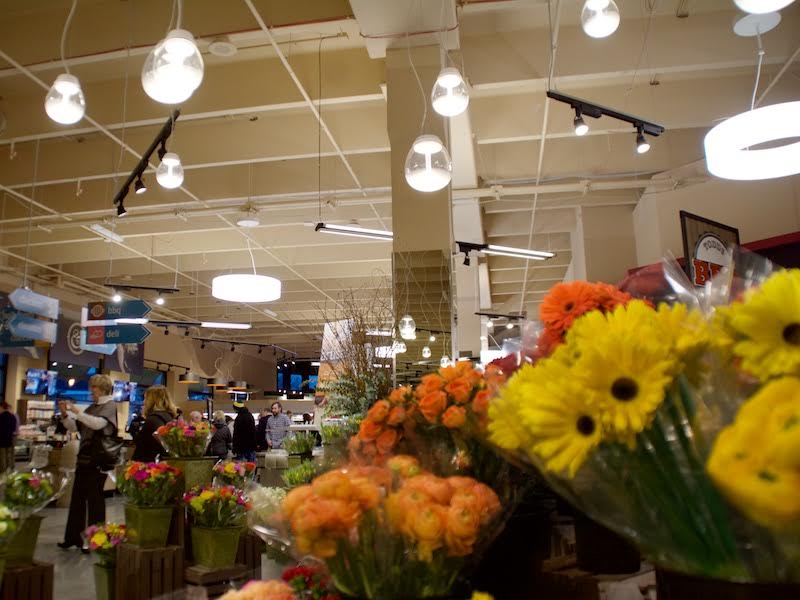
Where is `pots`? This screenshot has width=800, height=600. pots is located at coordinates (226, 533), (158, 521), (197, 472), (30, 535), (101, 577).